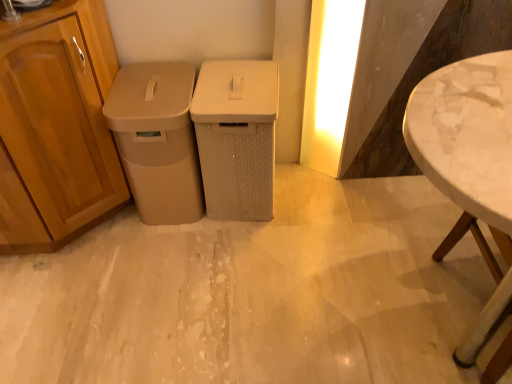
I want to click on free space in front of beige matte trash can at left, positioned as the first waste container in left-to-right order, so click(165, 254).